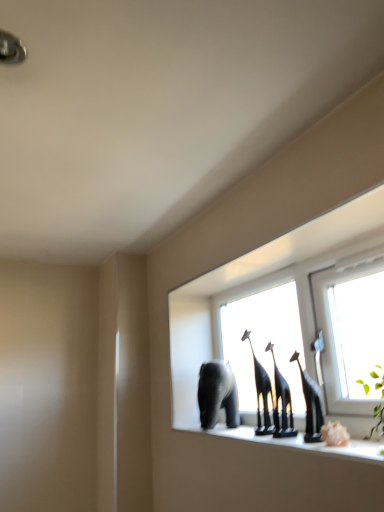
Question: From the image's perspective, is transparent glass window at center positioned above or below black glossy giraffe at center?

Choices:
 (A) below
 (B) above

Answer: (B)

Question: Considering the positions of point (342, 376) and point (274, 406), is point (342, 376) closer or farther from the camera than point (274, 406)?

Choices:
 (A) closer
 (B) farther

Answer: (A)

Question: Which of these objects is positioned closest to the black glossy giraffe at center?

Choices:
 (A) gray matte elephant at center
 (B) transparent glass window at center

Answer: (A)

Question: Estimate the real-world distances between objects in this image. Which object is farther from the black glossy giraffe at center?

Choices:
 (A) gray matte elephant at center
 (B) transparent glass window at center

Answer: (B)